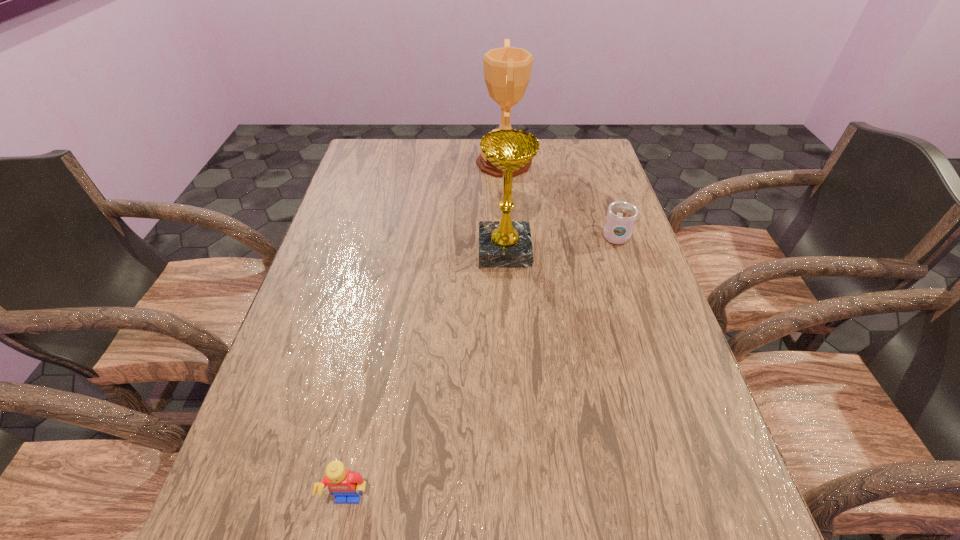
In the image, there is a desktop. Identify the location of free space at the far left corner. (374, 152).

Locate an element on the screen. The image size is (960, 540). free point between the second tallest object and the cup is located at coordinates (560, 242).

What are the coordinates of `free space between the leftmost object and the second tallest object` in the screenshot? It's located at (427, 376).

Identify the location of free spot between the nearest object and the nearer award. Image resolution: width=960 pixels, height=540 pixels. (x=427, y=376).

Identify the location of free spot between the farther award and the leftmost object. The height and width of the screenshot is (540, 960). (426, 333).

Locate an element on the screen. The width and height of the screenshot is (960, 540). free spot between the Lego and the rightmost object is located at coordinates (482, 369).

Locate an element on the screen. The width and height of the screenshot is (960, 540). empty location between the nearest object and the cup is located at coordinates (482, 369).

Identify the location of vacant space that is in between the third shortest object and the nearest object. (427, 376).

Where is `unoccupied position between the cup and the second tallest object`? unoccupied position between the cup and the second tallest object is located at coordinates (560, 242).

In order to click on free space between the rightmost object and the nearer award in this screenshot , I will do `click(560, 242)`.